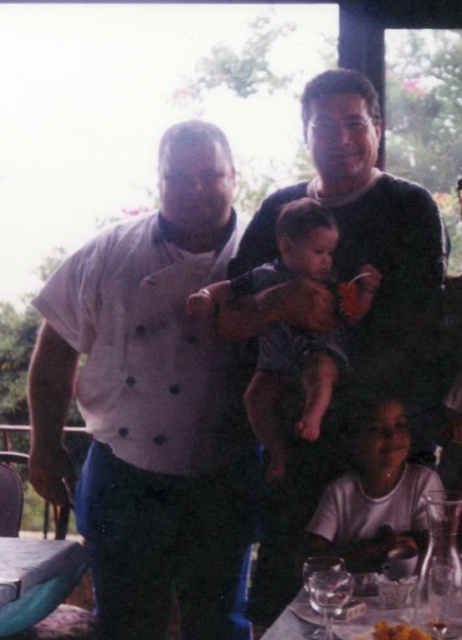
You are standing in front of the table in the image. There are two points marked on the table surface. One is at coordinate point (418, 596) and the other at point (330, 627). Which of these two points is closer to your viewpoint?

The point at coordinate (418, 596) is closer to your viewpoint because it is closer to the camera than the point at (330, 627).